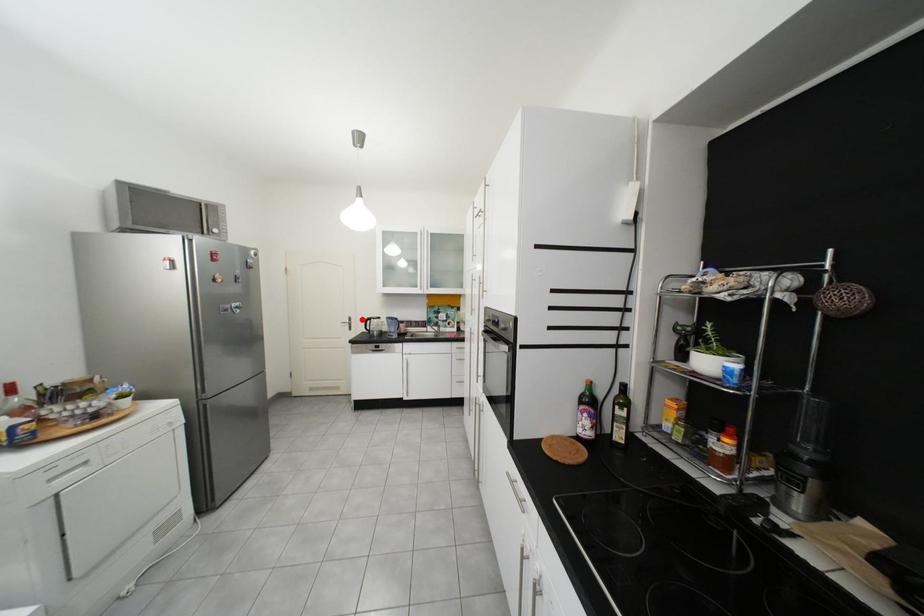
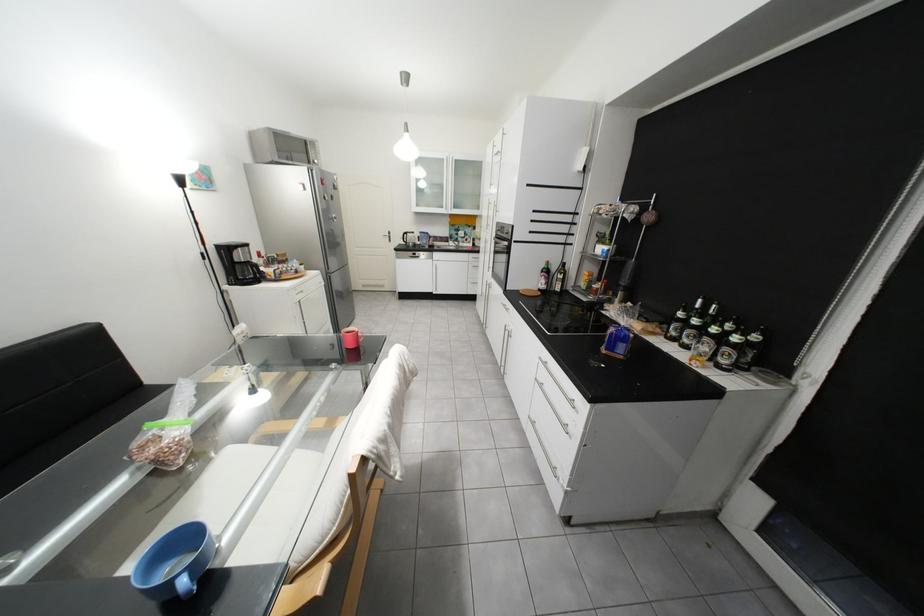
Question: I am providing you with two images of the same scene from different viewpoints. A red point is marked on the first image. At the location where the point appears in image 1, is it still visible in image 2?

Choices:
 (A) Yes
 (B) No

Answer: (A)